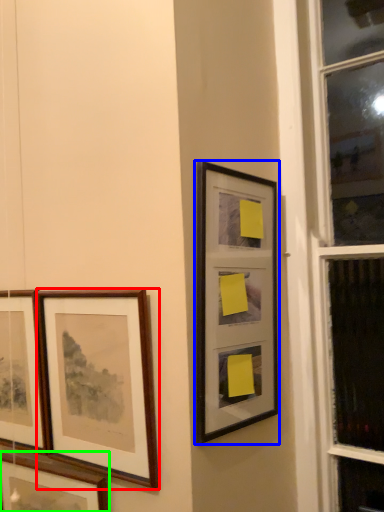
Question: Which is nearer to the picture frame (highlighted by a red box)? picture frame (highlighted by a blue box) or picture frame (highlighted by a green box).

Choices:
 (A) picture frame
 (B) picture frame

Answer: (B)